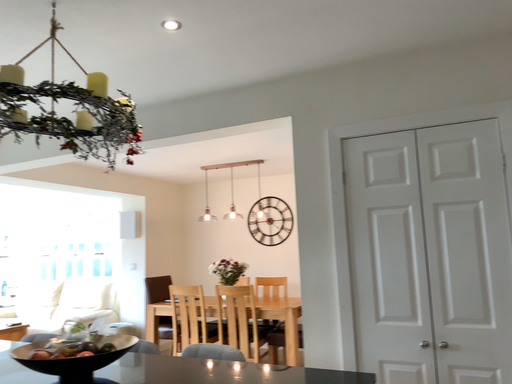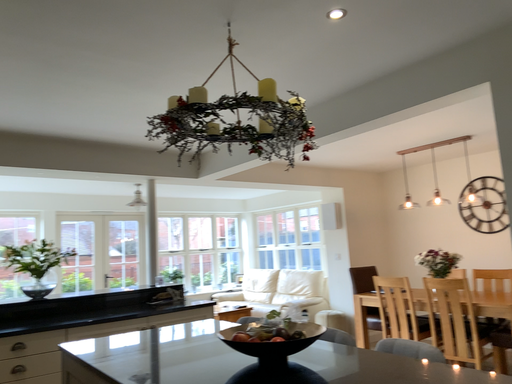
Question: How did the camera likely rotate when shooting the video?

Choices:
 (A) rotated right
 (B) rotated left

Answer: (B)